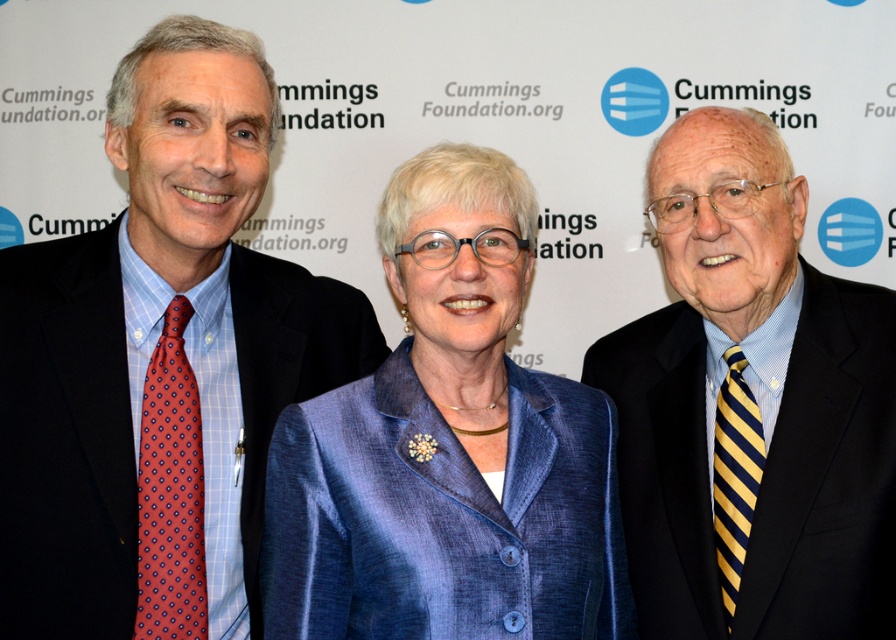
You are a photographer at the Cummings Foundation event and need to adjust the camera focus. The blue satin blazer at center and the blue striped tie at right are part of the scene. Given their distance, can you fit both into a single closeup shot if your camera has a maximum focus range that can capture objects up to 12 inches apart?

The blue satin blazer at center and blue striped tie at right are 11.84 inches apart, which is within the camera maximum focus range of 12 inches. Therefore, both can be captured in a single closeup shot.

You are taking a photo of two points in the scene described. Which point is closer to the camera, point (192,250) or point (785,612)?

Point (192,250) is closer to the camera than point (785,612).